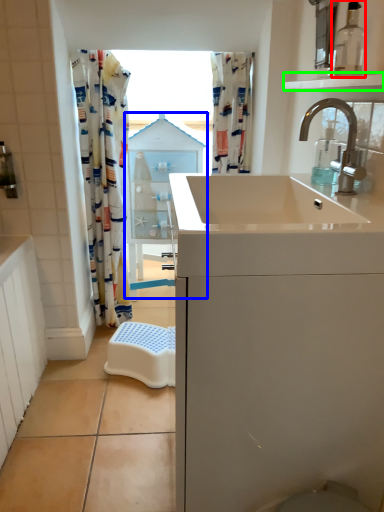
Question: Which is farther away from bottle (highlighted by a red box)? medicine cabinet (highlighted by a blue box) or balustrade (highlighted by a green box)?

Choices:
 (A) medicine cabinet
 (B) balustrade

Answer: (A)